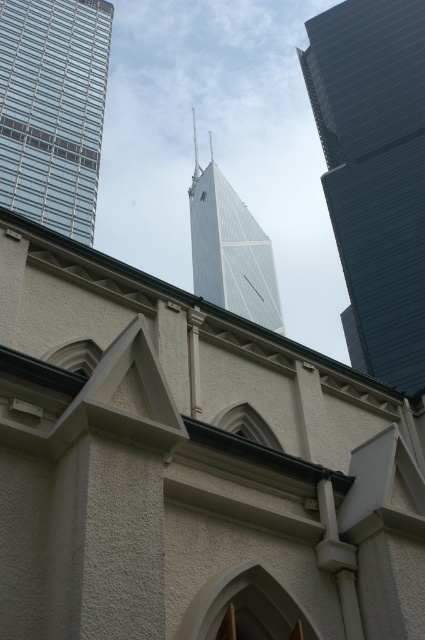
Question: Is white glass tower at center behind smooth glass spire at center?

Choices:
 (A) no
 (B) yes

Answer: (A)

Question: Which object is the farthest from the glassy steel skyscraper at upper left?

Choices:
 (A) smooth glass spire at center
 (B) white glass tower at center
 (C) dark blue glass skyscraper at right

Answer: (A)

Question: Does white glass tower at center lie behind smooth glass spire at center?

Choices:
 (A) yes
 (B) no

Answer: (B)

Question: Which of these objects is positioned closest to the glassy steel skyscraper at upper left?

Choices:
 (A) white glass tower at center
 (B) smooth glass spire at center
 (C) dark blue glass skyscraper at right

Answer: (C)

Question: Which point is farther to the camera?

Choices:
 (A) glassy steel skyscraper at upper left
 (B) white glass tower at center
 (C) smooth glass spire at center
 (D) dark blue glass skyscraper at right

Answer: (C)

Question: Can you confirm if dark blue glass skyscraper at right is positioned above white glass tower at center?

Choices:
 (A) yes
 (B) no

Answer: (A)